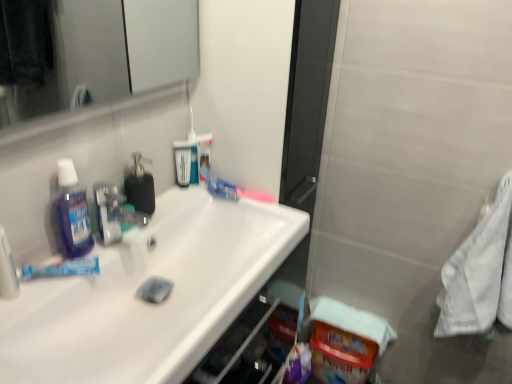
Find the location of a particular element. The height and width of the screenshot is (384, 512). vacant space in front of translucent plastic toothbrush at upper center, which is counted as the 1th toothbrush, starting from the left is located at coordinates (181, 200).